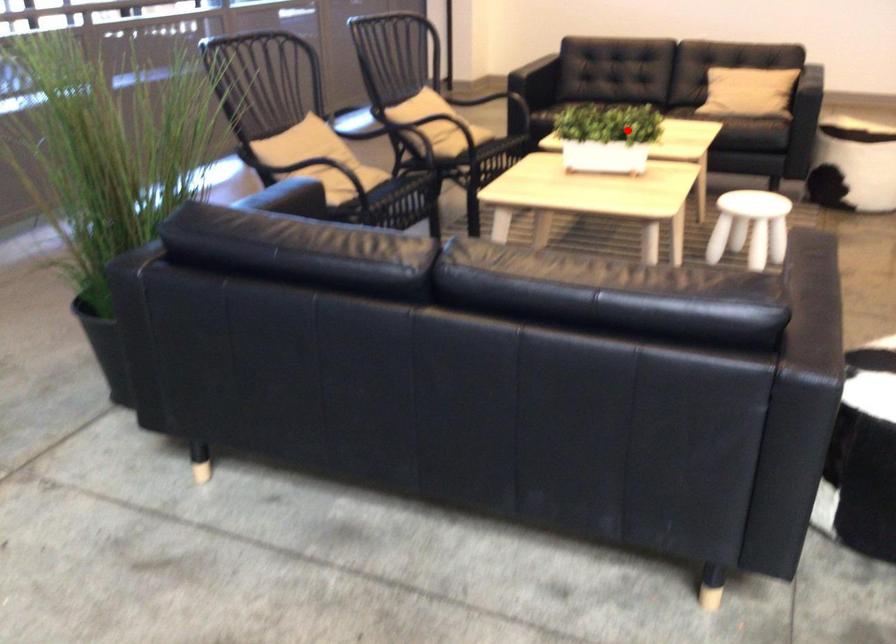
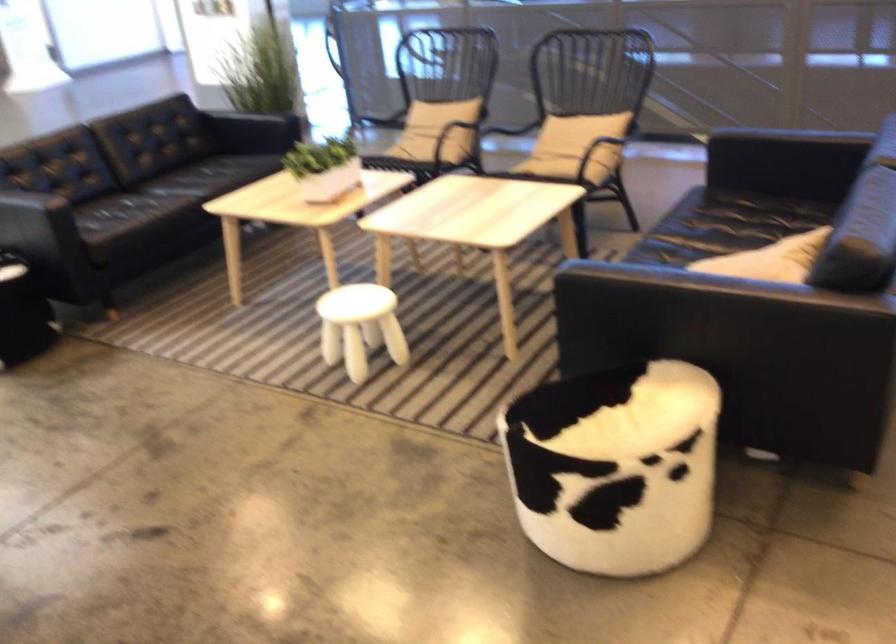
In the second image, find the point that corresponds to the highlighted location in the first image.

(323, 167)